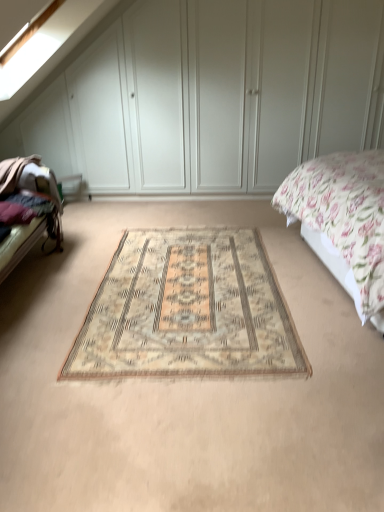
Question: Does beige carpet at center have a lesser height compared to beige woven rug at center?

Choices:
 (A) yes
 (B) no

Answer: (B)

Question: Is beige carpet at center closer to the viewer compared to beige woven rug at center?

Choices:
 (A) no
 (B) yes

Answer: (B)

Question: Does beige carpet at center come behind beige woven rug at center?

Choices:
 (A) no
 (B) yes

Answer: (A)

Question: Considering the relative positions of beige carpet at center and beige woven rug at center in the image provided, is beige carpet at center to the left of beige woven rug at center from the viewer's perspective?

Choices:
 (A) no
 (B) yes

Answer: (B)

Question: Is beige carpet at center taller than beige woven rug at center?

Choices:
 (A) no
 (B) yes

Answer: (B)

Question: Considering the relative positions of beige carpet at center and beige woven rug at center in the image provided, is beige carpet at center to the right of beige woven rug at center from the viewer's perspective?

Choices:
 (A) yes
 (B) no

Answer: (B)

Question: Is the position of dark brown fabric bed frame at left less distant than that of floral fabric bed at right?

Choices:
 (A) no
 (B) yes

Answer: (A)

Question: Is the depth of dark brown fabric bed frame at left greater than that of floral fabric bed at right?

Choices:
 (A) yes
 (B) no

Answer: (A)

Question: Does dark brown fabric bed frame at left appear on the left side of floral fabric bed at right?

Choices:
 (A) no
 (B) yes

Answer: (B)

Question: From a real-world perspective, is dark brown fabric bed frame at left on floral fabric bed at right?

Choices:
 (A) yes
 (B) no

Answer: (A)

Question: From the image's perspective, is dark brown fabric bed frame at left located beneath floral fabric bed at right?

Choices:
 (A) no
 (B) yes

Answer: (A)

Question: From the image's perspective, is dark brown fabric bed frame at left over floral fabric bed at right?

Choices:
 (A) yes
 (B) no

Answer: (A)

Question: Does beige woven rug at center have a greater height compared to white matte wardrobe at center?

Choices:
 (A) no
 (B) yes

Answer: (A)